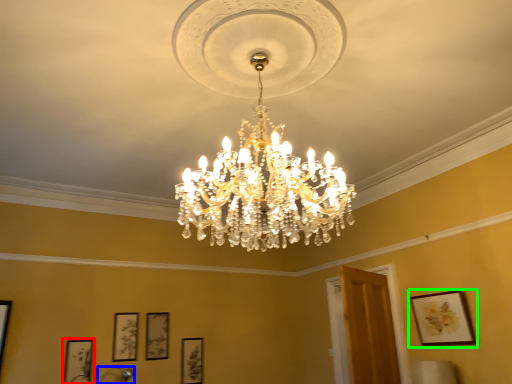
Question: Based on their relative distances, which object is nearer to picture frame (highlighted by a red box)? Choose from lamp (highlighted by a blue box) and picture frame (highlighted by a green box).

Choices:
 (A) lamp
 (B) picture frame

Answer: (A)